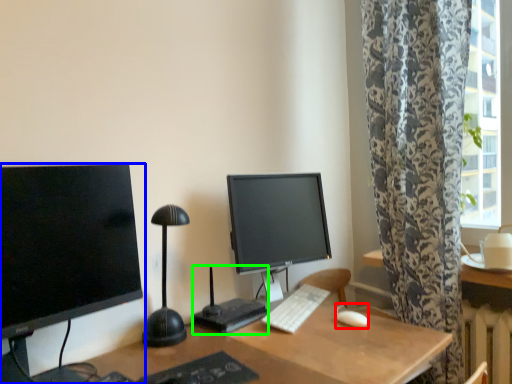
Question: Which is farther away from mouse (highlighted by a red box)? computer monitor (highlighted by a blue box) or computer desk (highlighted by a green box)?

Choices:
 (A) computer monitor
 (B) computer desk

Answer: (A)